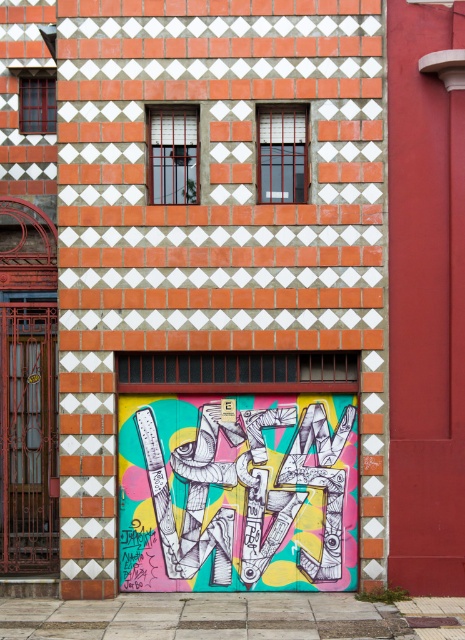
Does colorful graffiti at center appear on the right side of metallic painted garage door at lower left?

Correct, you'll find colorful graffiti at center to the right of metallic painted garage door at lower left.

Is colorful graffiti at center taller than metallic painted garage door at lower left?

In fact, colorful graffiti at center may be shorter than metallic painted garage door at lower left.

Which is in front, point (125, 566) or point (26, 524)?

Point (125, 566)

Locate an element on the screen. The width and height of the screenshot is (465, 640). colorful graffiti at center is located at coordinates (238, 492).